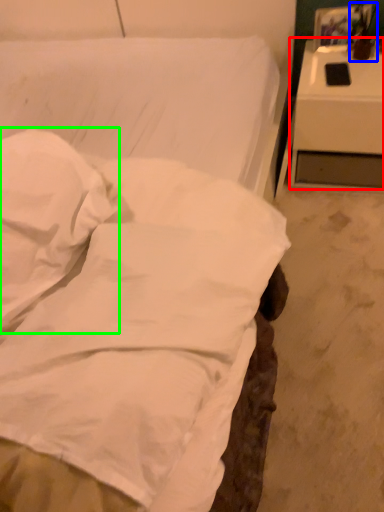
Question: Which object is positioned closest to nightstand (highlighted by a red box)? Select from table lamp (highlighted by a blue box) and pillow (highlighted by a green box).

Choices:
 (A) table lamp
 (B) pillow

Answer: (A)